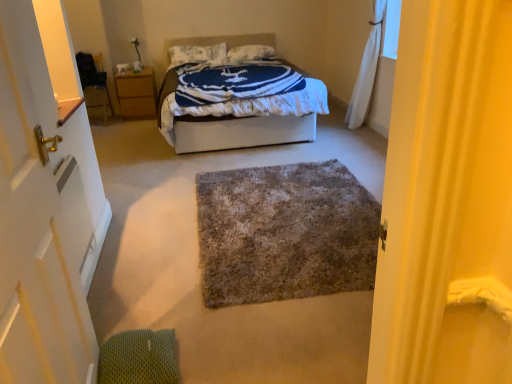
You are a GUI agent. You are given a task and a screenshot of the screen. Output one action in this format:
    pyautogui.click(x=<x>, y=<y>)
    Task: Click on the white soft pillow at center, the second pillow viewed from the left
    Image resolution: width=512 pixels, height=384 pixels.
    Given the screenshot: What is the action you would take?
    pyautogui.click(x=251, y=53)

What is the approximate width of white soft pillow at upper center, arranged as the 2th pillow when viewed from the right?

It is 40.70 centimeters.

Locate an element on the screen. Image resolution: width=512 pixels, height=384 pixels. white soft pillow at upper center, arranged as the 2th pillow when viewed from the right is located at coordinates (196, 54).

Where is `white fabric bed at center`? The height and width of the screenshot is (384, 512). white fabric bed at center is located at coordinates (237, 131).

You are a GUI agent. You are given a task and a screenshot of the screen. Output one action in this format:
    pyautogui.click(x=<x>, y=<y>)
    Task: Click on the white wooden door at left
    The width and height of the screenshot is (512, 384).
    Given the screenshot: What is the action you would take?
    pyautogui.click(x=46, y=202)

Do you think white soft pillow at center, which is the 1th pillow from right to left, is within shaggy gray rug at center, or outside of it?

white soft pillow at center, which is the 1th pillow from right to left, is spatially situated outside shaggy gray rug at center.

Is white soft pillow at center, the second pillow viewed from the left, turned away from shaggy gray rug at center?

No, shaggy gray rug at center is not at the back of white soft pillow at center, the second pillow viewed from the left.

From a real-world perspective, is white soft pillow at center, which is the 1th pillow from right to left, positioned above or below shaggy gray rug at center?

Clearly, from a real-world perspective, white soft pillow at center, which is the 1th pillow from right to left, is above shaggy gray rug at center.

Looking at this image, is white wooden door at left located within wooden nightstand at left?

Definitely not — white wooden door at left is not inside wooden nightstand at left.

Considering the sizes of wooden nightstand at left and white wooden door at left in the image, is wooden nightstand at left bigger or smaller than white wooden door at left?

In the image, wooden nightstand at left appears to be larger than white wooden door at left.

Is wooden nightstand at left in front of or behind white wooden door at left in the image?

wooden nightstand at left is behind white wooden door at left.

Is shaggy gray rug at center at the left side of white fabric bed at center?

Incorrect, shaggy gray rug at center is not on the left side of white fabric bed at center.

Can we say shaggy gray rug at center lies outside white fabric bed at center?

shaggy gray rug at center is positioned outside white fabric bed at center.

In the image, there is a shaggy gray rug at center. Identify the location of bed above it (from the image's perspective). (237, 131).

Between point (260, 189) and point (163, 125), which one is positioned in front?

Point (260, 189)

From the picture: Can you see white soft pillow at center, the second pillow viewed from the left, touching white sheer curtain at upper right?

No, white soft pillow at center, the second pillow viewed from the left, is not with white sheer curtain at upper right.

Consider the image. Which object is positioned more to the left, white soft pillow at center, which is the 1th pillow from right to left, or white sheer curtain at upper right?

Positioned to the left is white soft pillow at center, which is the 1th pillow from right to left.

Find the location of a particular element. curtain on the right of the white soft pillow at center, which is the 1th pillow from right to left is located at coordinates (366, 71).

From a real-world perspective, is white soft pillow at center, the second pillow viewed from the left, above or below white sheer curtain at upper right?

white soft pillow at center, the second pillow viewed from the left, is above white sheer curtain at upper right.

From the image's perspective, between white soft pillow at center, the second pillow viewed from the left, and white wooden door at left, which one is located above?

white soft pillow at center, the second pillow viewed from the left, from the image's perspective.

Is white soft pillow at center, which is the 1th pillow from right to left, looking in the opposite direction of white wooden door at left?

No, white wooden door at left is not at the back of white soft pillow at center, which is the 1th pillow from right to left.

The width and height of the screenshot is (512, 384). Find the location of `door lying in front of the white soft pillow at center, the second pillow viewed from the left`. door lying in front of the white soft pillow at center, the second pillow viewed from the left is located at coordinates (46, 202).

Considering the sizes of objects white soft pillow at center, the second pillow viewed from the left, and white wooden door at left in the image provided, who is shorter, white soft pillow at center, the second pillow viewed from the left, or white wooden door at left?

With less height is white soft pillow at center, the second pillow viewed from the left.

Considering the relative sizes of white soft pillow at center, which is the 1th pillow from right to left, and wooden nightstand at left in the image provided, is white soft pillow at center, which is the 1th pillow from right to left, bigger than wooden nightstand at left?

No, white soft pillow at center, which is the 1th pillow from right to left, is not bigger than wooden nightstand at left.

Does white soft pillow at center, the second pillow viewed from the left, have a greater width compared to wooden nightstand at left?

Incorrect, the width of white soft pillow at center, the second pillow viewed from the left, does not surpass that of wooden nightstand at left.

Between point (234, 47) and point (131, 104), which one is positioned behind?

The point (234, 47) is farther from the camera.

Does white soft pillow at center, the second pillow viewed from the left, turn towards white fabric bed at center?

Yes, white soft pillow at center, the second pillow viewed from the left, faces towards white fabric bed at center.

Could white fabric bed at center be considered to be inside white soft pillow at center, which is the 1th pillow from right to left?

No, white soft pillow at center, which is the 1th pillow from right to left, does not contain white fabric bed at center.

How many degrees apart are the facing directions of white soft pillow at center, which is the 1th pillow from right to left, and white fabric bed at center?

2.42 degrees separate the facing orientations of white soft pillow at center, which is the 1th pillow from right to left, and white fabric bed at center.

Is point (230, 53) behind point (233, 133)?

Yes, it is behind point (233, 133).

In the image, there is a white soft pillow at center, which is the 1th pillow from right to left. Identify the location of doormat below it (from the image's perspective). The height and width of the screenshot is (384, 512). (284, 233).

What are the coordinates of `door above the wooden nightstand at left (from a real-world perspective)` in the screenshot? It's located at (46, 202).

Consider the image. When comparing their distances from white soft pillow at upper center, the 1th pillow from the left, does shaggy gray rug at center or white sheer curtain at upper right seem closer?

Among the two, white sheer curtain at upper right is located nearer to white soft pillow at upper center, the 1th pillow from the left.

Considering their positions, is wooden nightstand at left positioned closer to white soft pillow at upper center, arranged as the 2th pillow when viewed from the right, than white fabric bed at center?

The object closer to white soft pillow at upper center, arranged as the 2th pillow when viewed from the right, is wooden nightstand at left.

From the image, which object appears to be farther from white soft pillow at upper center, the 1th pillow from the left, white sheer curtain at upper right or white fabric bed at center?

white sheer curtain at upper right is positioned further to the anchor white soft pillow at upper center, the 1th pillow from the left.

When comparing their distances from wooden nightstand at left, does white sheer curtain at upper right or white fabric bed at center seem closer?

The object closer to wooden nightstand at left is white fabric bed at center.

Looking at the image, which one is located further to white sheer curtain at upper right, shaggy gray rug at center or white soft pillow at upper center, the 1th pillow from the left?

white soft pillow at upper center, the 1th pillow from the left, is further to white sheer curtain at upper right.

Considering their positions, is white soft pillow at upper center, arranged as the 2th pillow when viewed from the right, positioned further to white wooden door at left than wooden nightstand at left?

white soft pillow at upper center, arranged as the 2th pillow when viewed from the right.

Which object lies nearer to the anchor point white fabric bed at center, white wooden door at left or white soft pillow at upper center, arranged as the 2th pillow when viewed from the right?

Based on the image, white soft pillow at upper center, arranged as the 2th pillow when viewed from the right, appears to be nearer to white fabric bed at center.

Estimate the real-world distances between objects in this image. Which object is further from white sheer curtain at upper right, white fabric bed at center or wooden nightstand at left?

wooden nightstand at left.

The image size is (512, 384). I want to click on pillow between white soft pillow at upper center, arranged as the 2th pillow when viewed from the right, and white sheer curtain at upper right, so click(251, 53).

I want to click on pillow positioned between white fabric bed at center and white soft pillow at center, which is the 1th pillow from right to left, from near to far, so click(196, 54).

Where is `bed located between white wooden door at left and wooden nightstand at left in the depth direction`? bed located between white wooden door at left and wooden nightstand at left in the depth direction is located at coordinates (237, 131).

The height and width of the screenshot is (384, 512). Identify the location of doormat between white wooden door at left and white fabric bed at center along the z-axis. (284, 233).